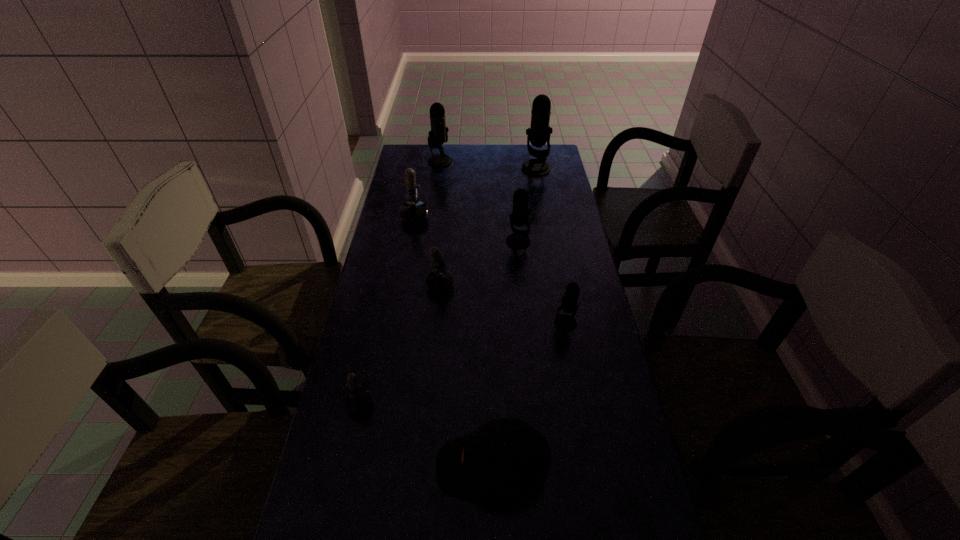
Identify the location of free space located 0.370m on the back of the second farthest white microphone. (431, 211).

Find the location of a particular element. This screenshot has width=960, height=540. vacant point located on the left of the nearest black microphone is located at coordinates (443, 323).

Identify the location of vacant region located 0.050m with a logo on the front of the nearest object. This screenshot has height=540, width=960. (415, 467).

This screenshot has height=540, width=960. Identify the location of free space located with a logo on the front of the nearest object. (384, 467).

You are a GUI agent. You are given a task and a screenshot of the screen. Output one action in this format:
    pyautogui.click(x=<x>, y=<y>)
    Task: Click on the vacant position located with a logo on the front of the nearest object
    The width and height of the screenshot is (960, 540).
    Given the screenshot: What is the action you would take?
    pyautogui.click(x=415, y=467)

Find the location of a particular element. vacant space situated 0.270m on the back of the shortest microphone is located at coordinates (384, 292).

I want to click on object at the far left corner, so pyautogui.click(x=438, y=135).

At what (x,y) coordinates should I click in order to perform the action: click on object that is at the far right corner. Please return your answer as a coordinate pair (x, y). This screenshot has height=540, width=960. Looking at the image, I should click on [x=538, y=134].

The image size is (960, 540). What are the coordinates of `vacant space at the far edge` in the screenshot? It's located at (451, 166).

You are a GUI agent. You are given a task and a screenshot of the screen. Output one action in this format:
    pyautogui.click(x=<x>, y=<y>)
    Task: Click on the vacant space at the left edge of the desktop
    The image size is (960, 540).
    Given the screenshot: What is the action you would take?
    pyautogui.click(x=390, y=276)